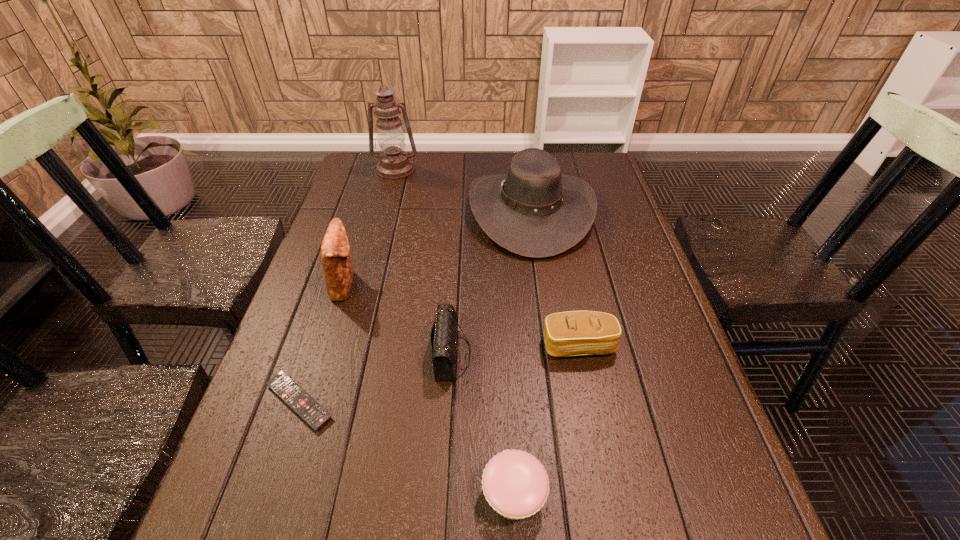
Locate an element on the screen. oil lamp is located at coordinates (394, 163).

Find the location of a particular element. cowboy hat is located at coordinates (533, 211).

This screenshot has height=540, width=960. Identify the location of the farthest clutch bag. (338, 271).

Image resolution: width=960 pixels, height=540 pixels. In order to click on the tallest clutch bag in this screenshot , I will do `click(338, 271)`.

I want to click on the second clutch bag from right to left, so click(443, 337).

Identify the location of the rightmost clutch bag. This screenshot has height=540, width=960. (572, 333).

At what (x,y) coordinates should I click in order to perform the action: click on the second shortest object. Please return your answer as a coordinate pair (x, y). Looking at the image, I should click on (515, 484).

Find the location of a particular element. cupcake is located at coordinates (515, 484).

Identify the location of remote control. This screenshot has width=960, height=540. 288,390.

Identify the location of free region located on the front of the oil lamp. The height and width of the screenshot is (540, 960). (372, 257).